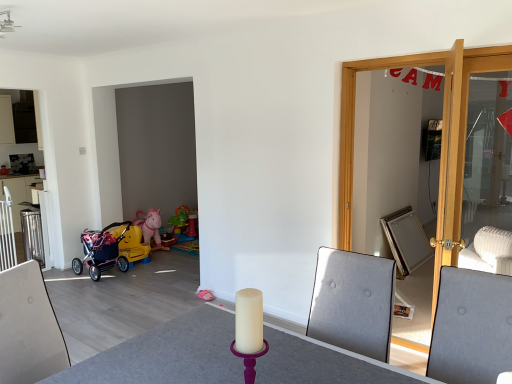
Question: In the image, is gray fabric swivel chair at right positioned in front of or behind light wood door at right?

Choices:
 (A) behind
 (B) front

Answer: (B)

Question: Is point (465, 350) positioned closer to the camera than point (433, 301)?

Choices:
 (A) farther
 (B) closer

Answer: (B)

Question: Considering the real-world distances, which object is farthest from the gray fabric swivel chair at right?

Choices:
 (A) pink fabric stroller at lower left
 (B) light wood door at right
 (C) matte white cabinet at upper left
 (D) white matte round table at center

Answer: (C)

Question: Estimate the real-world distances between objects in this image. Which object is closer to the light wood door at right?

Choices:
 (A) matte white cabinet at upper left
 (B) gray fabric swivel chair at right
 (C) pink fabric stroller at lower left
 (D) white matte round table at center

Answer: (B)